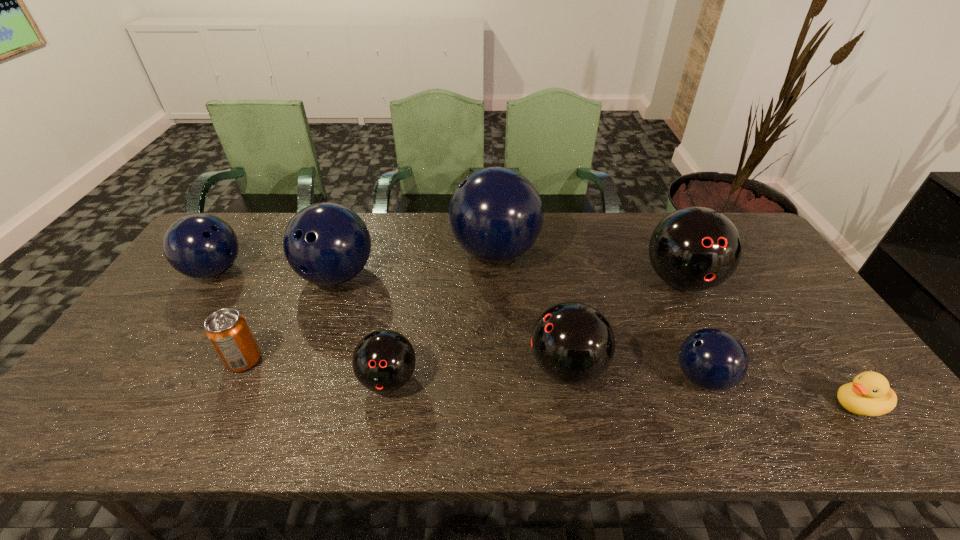
At what (x,y) coordinates should I click in order to perform the action: click on free space located on the face of the yellow duckling. Please return your answer as a coordinate pair (x, y). This screenshot has width=960, height=540. Looking at the image, I should click on (737, 405).

This screenshot has height=540, width=960. I want to click on vacant space located on the face of the yellow duckling, so click(663, 405).

What are the coordinates of `free space located 0.270m on the face of the yellow duckling` in the screenshot? It's located at (715, 405).

Locate an element on the screen. object at the near edge is located at coordinates (869, 394).

Where is `object at the left edge`? object at the left edge is located at coordinates (201, 246).

Identify the location of object that is positioned at the right edge. This screenshot has height=540, width=960. (869, 394).

At what (x,y) coordinates should I click in order to perform the action: click on object that is positioned at the far left corner. Please return your answer as a coordinate pair (x, y). The width and height of the screenshot is (960, 540). Looking at the image, I should click on (201, 246).

The height and width of the screenshot is (540, 960). Find the location of `object that is at the near right corner`. object that is at the near right corner is located at coordinates (869, 394).

In the image, there is a desktop. Where is `blank space at the far edge`? The width and height of the screenshot is (960, 540). blank space at the far edge is located at coordinates (416, 244).

I want to click on free location at the near edge of the desktop, so 193,413.